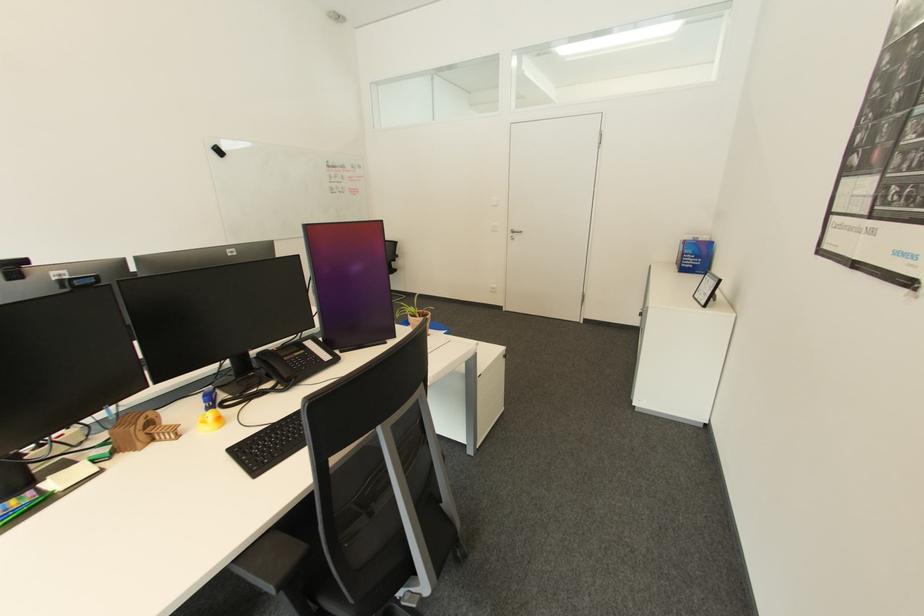
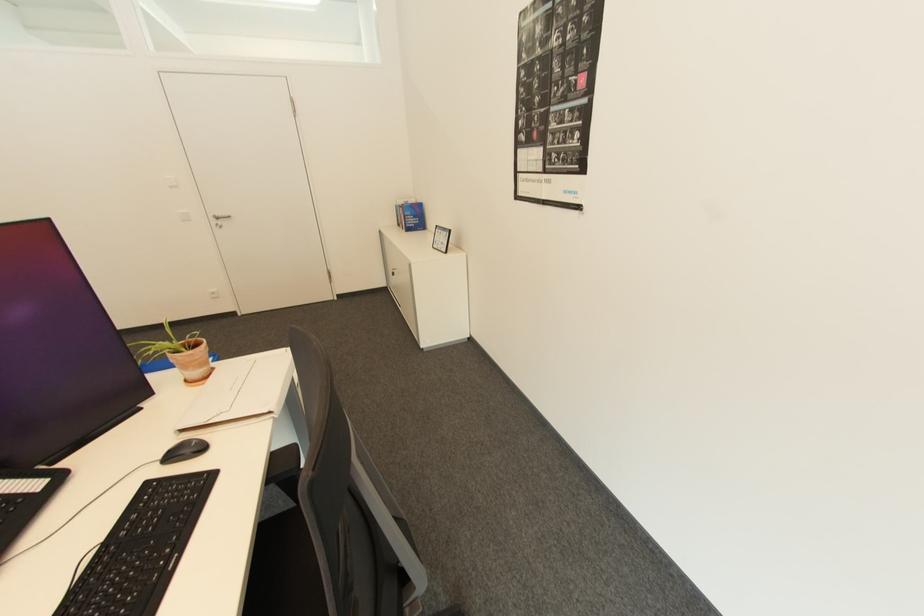
Question: The images are taken continuously from a first-person perspective. In which direction is your viewpoint rotating?

Choices:
 (A) Left
 (B) Right
 (C) Up
 (D) Down

Answer: (B)